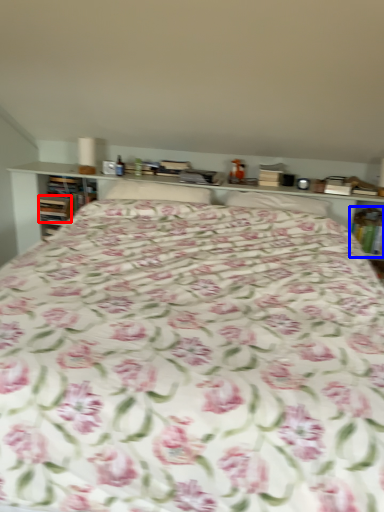
Question: Which object is closer to the camera taking this photo, book (highlighted by a red box) or book (highlighted by a blue box)?

Choices:
 (A) book
 (B) book

Answer: (B)